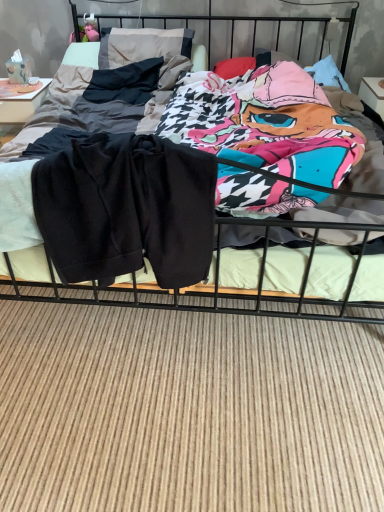
Question: Is dark gray fabric pillow at upper left wider than black fleece shorts at center?

Choices:
 (A) no
 (B) yes

Answer: (A)

Question: Does dark gray fabric pillow at upper left have a lesser width compared to black fleece shorts at center?

Choices:
 (A) no
 (B) yes

Answer: (B)

Question: Is dark gray fabric pillow at upper left to the right of black fleece shorts at center from the viewer's perspective?

Choices:
 (A) no
 (B) yes

Answer: (A)

Question: Can you confirm if dark gray fabric pillow at upper left is taller than black fleece shorts at center?

Choices:
 (A) yes
 (B) no

Answer: (A)

Question: Is dark gray fabric pillow at upper left oriented away from black fleece shorts at center?

Choices:
 (A) no
 (B) yes

Answer: (A)

Question: Is dark gray fabric pillow at upper left positioned before black fleece shorts at center?

Choices:
 (A) no
 (B) yes

Answer: (A)

Question: Considering the relative sizes of black fleece shorts at center and dark gray fabric pillow at upper left in the image provided, is black fleece shorts at center thinner than dark gray fabric pillow at upper left?

Choices:
 (A) no
 (B) yes

Answer: (A)

Question: Is black fleece shorts at center to the left of dark gray fabric pillow at upper left from the viewer's perspective?

Choices:
 (A) no
 (B) yes

Answer: (A)

Question: Does black fleece shorts at center touch dark gray fabric pillow at upper left?

Choices:
 (A) no
 (B) yes

Answer: (A)

Question: Is black fleece shorts at center looking in the opposite direction of dark gray fabric pillow at upper left?

Choices:
 (A) yes
 (B) no

Answer: (A)

Question: Is black fleece shorts at center outside dark gray fabric pillow at upper left?

Choices:
 (A) yes
 (B) no

Answer: (A)

Question: Does black fleece shorts at center have a greater height compared to dark gray fabric pillow at upper left?

Choices:
 (A) yes
 (B) no

Answer: (B)

Question: From the image's perspective, is dark gray fabric pillow at upper left located beneath black cotton shorts at center?

Choices:
 (A) yes
 (B) no

Answer: (B)